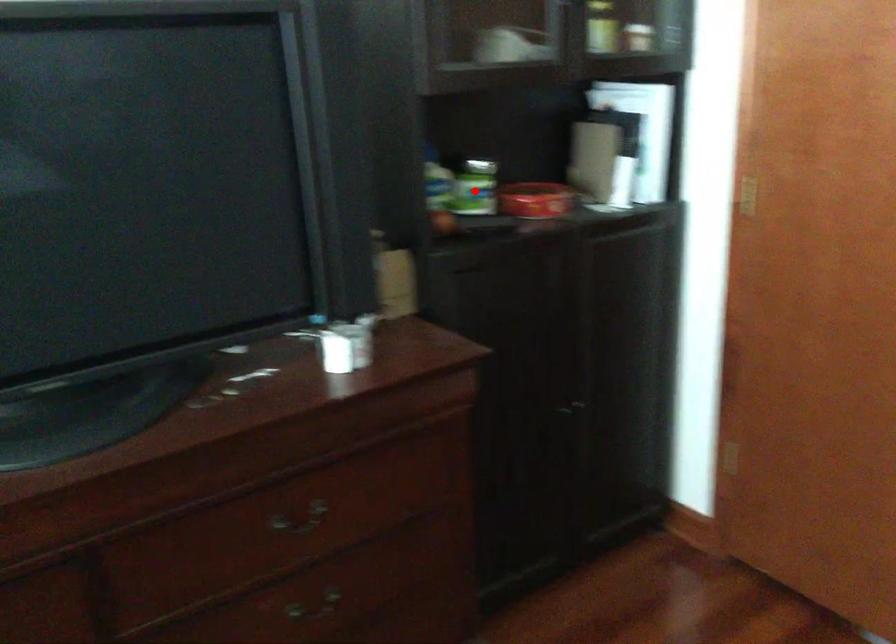
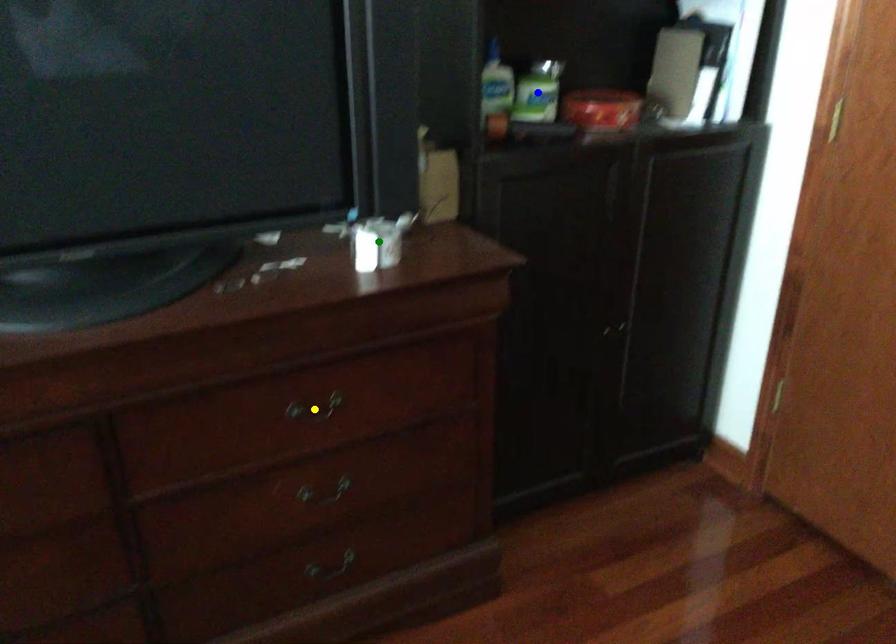
Question: I am providing you with two images of the same scene from different viewpoints. A red point is marked on the first image. You are given multiple points on the second image. Which spot in image 2 lines up with the point in image 1?

Choices:
 (A) yellow point
 (B) blue point
 (C) green point

Answer: (B)